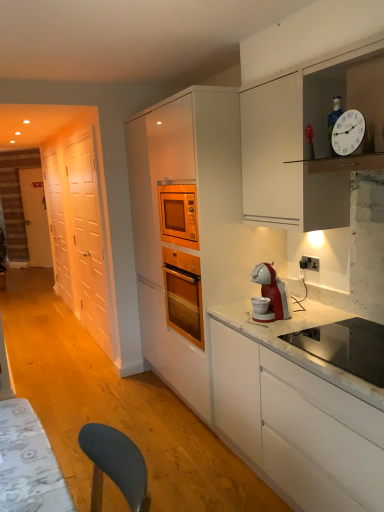
Question: Is white glossy door at left, the first glass door when ordered from back to front, positioned before white plastic clock at upper right?

Choices:
 (A) yes
 (B) no

Answer: (B)

Question: Does white glossy door at left, the first glass door when ordered from back to front, contain white plastic clock at upper right?

Choices:
 (A) no
 (B) yes

Answer: (A)

Question: Is white glossy door at left, placed as the second glass door when sorted from right to left, taller than white plastic clock at upper right?

Choices:
 (A) yes
 (B) no

Answer: (A)

Question: From a real-world perspective, is white glossy door at left, the first glass door when ordered from back to front, on top of white plastic clock at upper right?

Choices:
 (A) no
 (B) yes

Answer: (A)

Question: Is the surface of white glossy door at left, the first glass door from the left, in direct contact with white plastic clock at upper right?

Choices:
 (A) yes
 (B) no

Answer: (B)

Question: Is white glossy door at left, placed as the second glass door when sorted from right to left, shorter than white plastic clock at upper right?

Choices:
 (A) no
 (B) yes

Answer: (A)

Question: Is white plastic clock at upper right outside of white wooden door at left?

Choices:
 (A) yes
 (B) no

Answer: (A)

Question: Is the position of white plastic clock at upper right more distant than that of white wooden door at left?

Choices:
 (A) no
 (B) yes

Answer: (A)

Question: Considering the relative sizes of white plastic clock at upper right and white wooden door at left in the image provided, is white plastic clock at upper right bigger than white wooden door at left?

Choices:
 (A) yes
 (B) no

Answer: (B)

Question: From the image's perspective, is white plastic clock at upper right located above white wooden door at left?

Choices:
 (A) yes
 (B) no

Answer: (B)

Question: From a real-world perspective, is white plastic clock at upper right located higher than white wooden door at left?

Choices:
 (A) yes
 (B) no

Answer: (A)

Question: Is white plastic clock at upper right beside white wooden door at left?

Choices:
 (A) yes
 (B) no

Answer: (B)

Question: Is the depth of stainless steel sink at lower right less than that of black plastic electrical outlet at upper right?

Choices:
 (A) no
 (B) yes

Answer: (B)